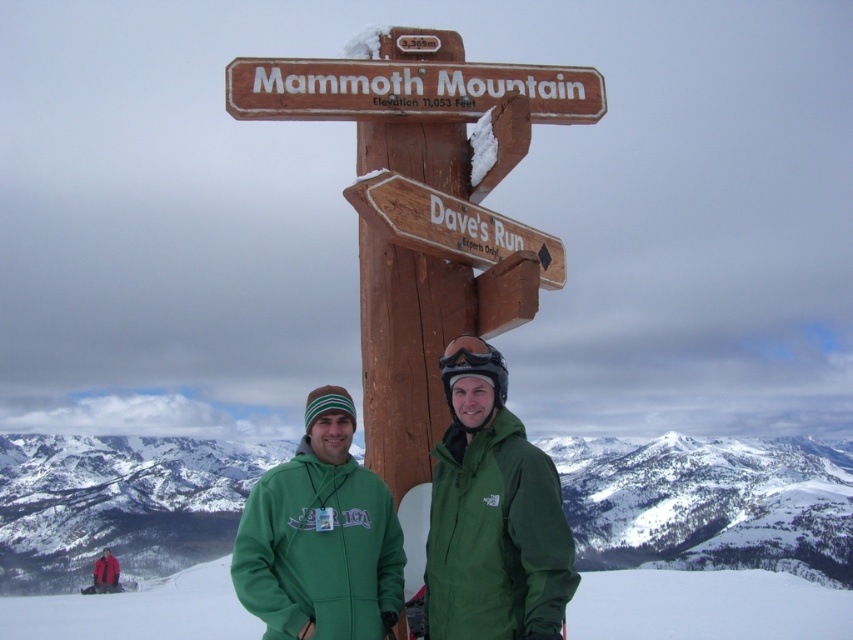
Which is behind, point (772, 476) or point (705, 593)?

The point (772, 476) is behind.

Who is lower down, snowy white mountain at center or green fabric ski slope at lower center?

snowy white mountain at center is lower down.

I want to click on snowy white mountain at center, so click(709, 502).

Between green matte jacket at center and wooden signpost at lower center, which one has more height?

green matte jacket at center

Does green matte jacket at center come in front of wooden signpost at lower center?

Yes, green matte jacket at center is closer to the viewer.

Between point (445, 568) and point (483, 269), which one is positioned in front?

Point (445, 568) is in front.

Where is `green matte jacket at center`? This screenshot has height=640, width=853. green matte jacket at center is located at coordinates (492, 515).

Is point (776, 525) positioned before point (233, 76)?

That is False.

Between snowy white mountain at center and wooden mammoth mountain sign at upper center, which one appears on the left side from the viewer's perspective?

wooden mammoth mountain sign at upper center is more to the left.

Is point (605, 545) positioned in front of point (491, 76)?

No, (605, 545) is behind (491, 76).

The width and height of the screenshot is (853, 640). Identify the location of snowy white mountain at center. (709, 502).